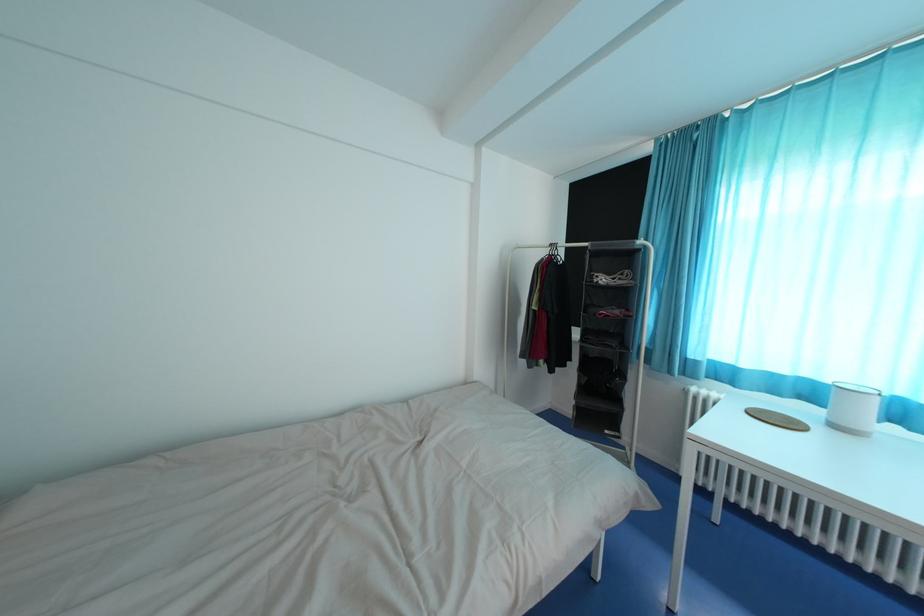
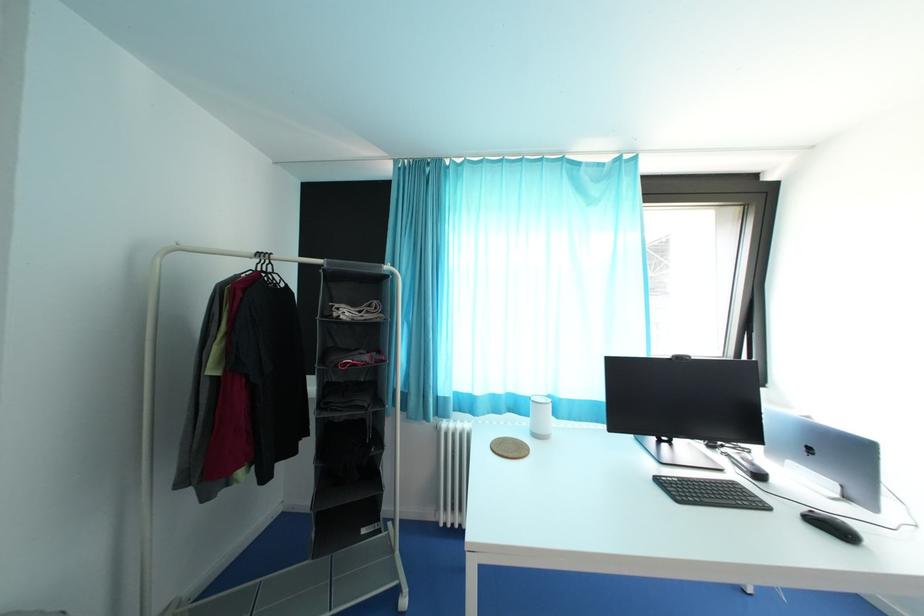
Question: Based on the continuous images, in which direction is the camera rotating? Reply with the corresponding letter.

Choices:
 (A) Left
 (B) Right
 (C) Up
 (D) Down

Answer: (B)